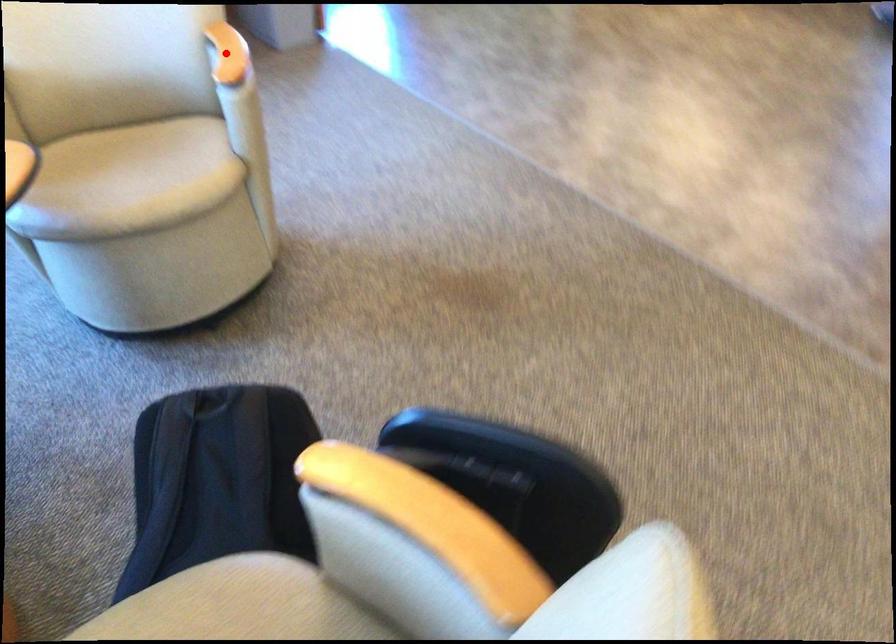
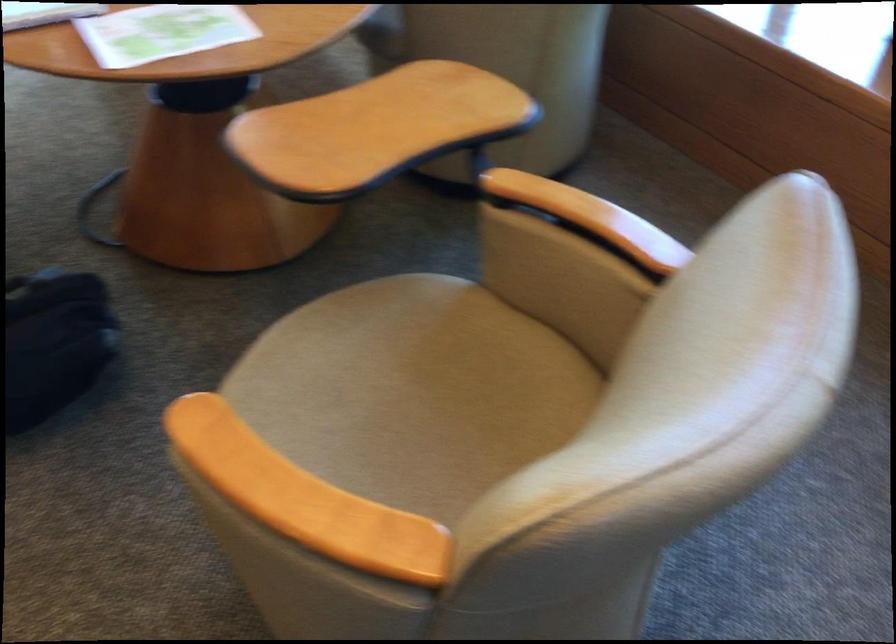
Question: I am providing you with two images of the same scene from different viewpoints. A red point is marked on the first image. Is the red point's position out of view in image 2?

Choices:
 (A) Yes
 (B) No

Answer: (A)